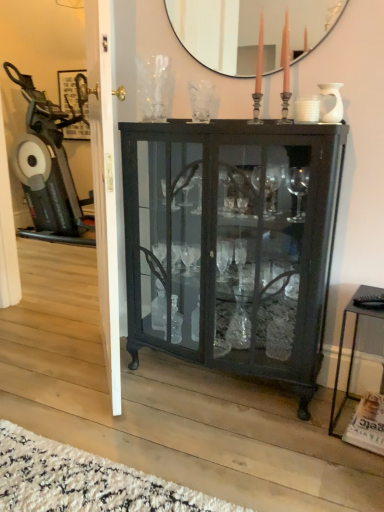
Question: From a real-world perspective, is black metal side table at lower right on white glossy door at center?

Choices:
 (A) yes
 (B) no

Answer: (B)

Question: From the image's perspective, is black metal side table at lower right below white glossy door at center?

Choices:
 (A) yes
 (B) no

Answer: (A)

Question: Is black metal side table at lower right aimed at white glossy door at center?

Choices:
 (A) no
 (B) yes

Answer: (A)

Question: Is black metal side table at lower right placed right next to white glossy door at center?

Choices:
 (A) no
 (B) yes

Answer: (A)

Question: Is the position of black metal side table at lower right less distant than that of white glossy door at center?

Choices:
 (A) yes
 (B) no

Answer: (B)

Question: From the image's perspective, relative to black metal side table at lower right, is matte black mirror at upper center above or below?

Choices:
 (A) above
 (B) below

Answer: (A)

Question: Visually, is matte black mirror at upper center positioned to the left or to the right of black metal side table at lower right?

Choices:
 (A) left
 (B) right

Answer: (A)

Question: Is point (253, 28) closer or farther from the camera than point (347, 372)?

Choices:
 (A) farther
 (B) closer

Answer: (A)

Question: Considering the positions of matte black mirror at upper center and black metal side table at lower right in the image, is matte black mirror at upper center taller or shorter than black metal side table at lower right?

Choices:
 (A) short
 (B) tall

Answer: (A)

Question: Looking at their shapes, would you say black metal side table at lower right is wider or thinner than white glossy door at center?

Choices:
 (A) thin
 (B) wide

Answer: (B)

Question: Is point (377, 292) positioned closer to the camera than point (100, 94)?

Choices:
 (A) closer
 (B) farther

Answer: (B)

Question: From a real-world perspective, is black metal side table at lower right above or below white glossy door at center?

Choices:
 (A) above
 (B) below

Answer: (B)

Question: Considering the relative positions of black metal side table at lower right and white glossy door at center in the image provided, is black metal side table at lower right to the left or to the right of white glossy door at center?

Choices:
 (A) right
 (B) left

Answer: (A)

Question: From a real-world perspective, is white glossy door at center physically located above or below black metal side table at lower right?

Choices:
 (A) below
 (B) above

Answer: (B)

Question: From the image's perspective, relative to black metal side table at lower right, is white glossy door at center above or below?

Choices:
 (A) below
 (B) above

Answer: (B)